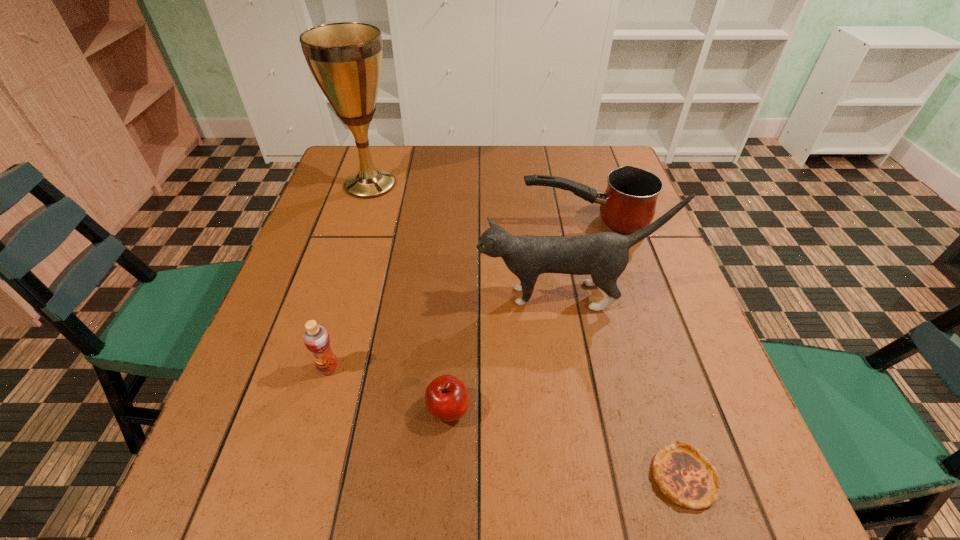
Identify the location of object located in the far edge section of the desktop. (345, 58).

Identify the location of object at the near edge. (685, 476).

The image size is (960, 540). I want to click on trophy cup that is at the left edge, so click(345, 58).

Where is `orange juice positioned at the left edge`? This screenshot has height=540, width=960. orange juice positioned at the left edge is located at coordinates (316, 338).

Locate an element on the screen. This screenshot has height=540, width=960. cat located at the right edge is located at coordinates (604, 256).

The width and height of the screenshot is (960, 540). Find the location of `saucepan that is at the right edge`. saucepan that is at the right edge is located at coordinates (628, 204).

You are a GUI agent. You are given a task and a screenshot of the screen. Output one action in this format:
    pyautogui.click(x=<x>, y=<y>)
    Task: Click on the quiche at the right edge
    
    Given the screenshot: What is the action you would take?
    pyautogui.click(x=685, y=476)

You are a GUI agent. You are given a task and a screenshot of the screen. Output one action in this format:
    pyautogui.click(x=<x>, y=<y>)
    Task: Click on the object at the far left corner
    This screenshot has height=540, width=960.
    Given the screenshot: What is the action you would take?
    pyautogui.click(x=345, y=58)

The width and height of the screenshot is (960, 540). What are the coordinates of `object located at the near right corner` in the screenshot? It's located at (685, 476).

Identify the location of vacant space at the far edge of the desktop. The image size is (960, 540). (412, 187).